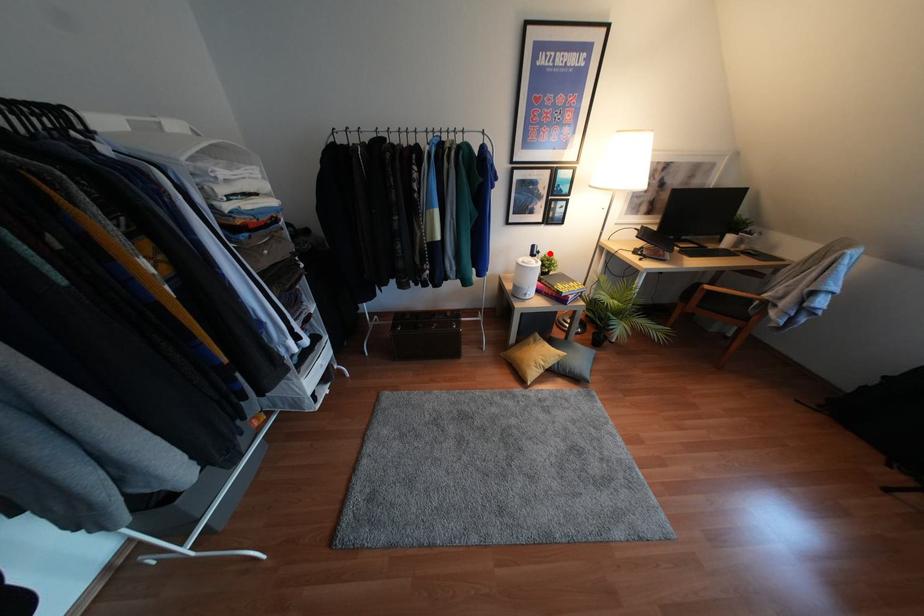
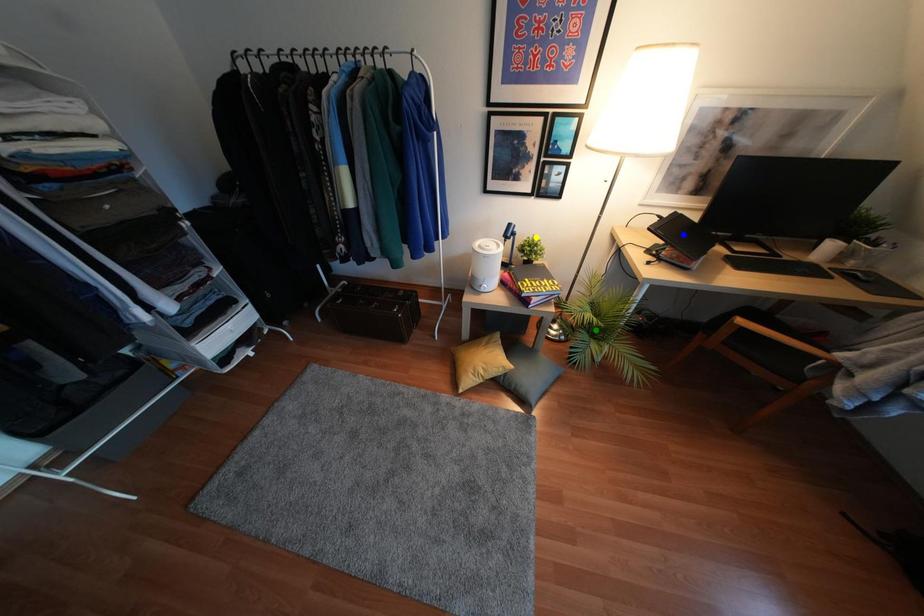
Question: I am providing you with two images of the same scene from different viewpoints. A red point is marked on the first image. You are given multiple points on the second image. Which mark in image 2 goes with the point in image 1?

Choices:
 (A) blue point
 (B) green point
 (C) yellow point

Answer: (C)